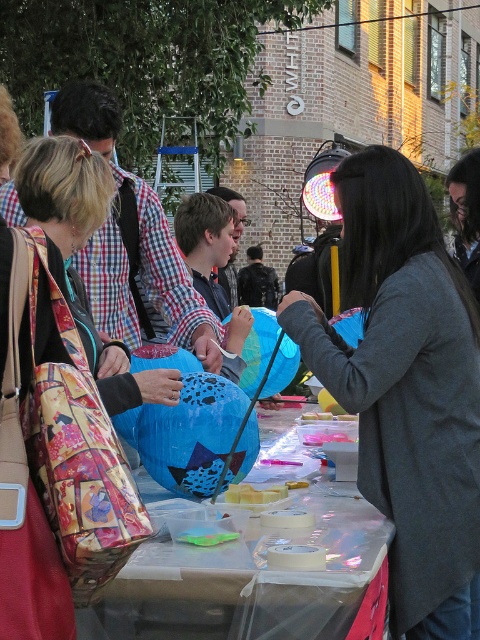
Can you confirm if printed fabric bag at left is smaller than blue glossy balloon at center?

Yes, printed fabric bag at left is smaller than blue glossy balloon at center.

Measure the distance between printed fabric bag at left and camera.

printed fabric bag at left is 2.04 meters from camera.

You are a GUI agent. You are given a task and a screenshot of the screen. Output one action in this format:
    pyautogui.click(x=<x>, y=<y>)
    Task: Click on the printed fabric bag at left
    The image size is (480, 640).
    Given the screenshot: What is the action you would take?
    pyautogui.click(x=76, y=452)

Who is shorter, gray fabric coat at center or blue glossy balloon at center?

blue glossy balloon at center

The height and width of the screenshot is (640, 480). Find the location of `gray fabric coat at center`. gray fabric coat at center is located at coordinates coord(407,388).

Does gray fabric coat at center have a larger size compared to floral fabric bag at left?

Indeed, gray fabric coat at center has a larger size compared to floral fabric bag at left.

Between gray fabric coat at center and floral fabric bag at left, which one appears on the left side from the viewer's perspective?

floral fabric bag at left

The image size is (480, 640). I want to click on gray fabric coat at center, so click(407, 388).